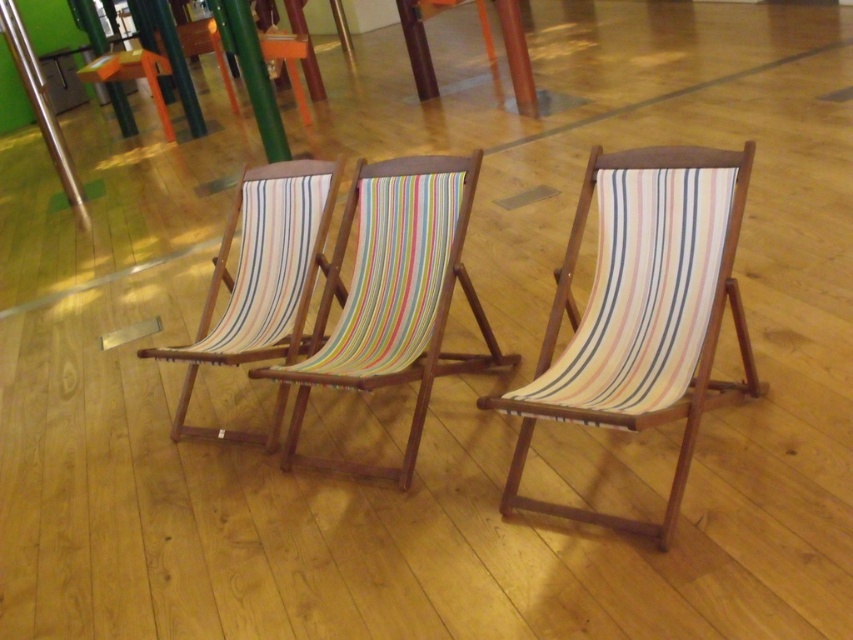
Is brushed metal pole at upper left wider than green wood pole at center?

Yes, brushed metal pole at upper left is wider than green wood pole at center.

Based on the photo, which is below, brushed metal pole at upper left or green wood pole at center?

Positioned lower is brushed metal pole at upper left.

Between point (77, 193) and point (273, 128), which one is positioned in front?

Point (273, 128) is in front.

The height and width of the screenshot is (640, 853). Find the location of `brushed metal pole at upper left`. brushed metal pole at upper left is located at coordinates (41, 106).

Does multicolored striped fabric deck chair at center lie in front of multicolored striped fabric at center?

Yes, multicolored striped fabric deck chair at center is closer to the viewer.

Can you confirm if multicolored striped fabric deck chair at center is taller than multicolored striped fabric at center?

In fact, multicolored striped fabric deck chair at center may be shorter than multicolored striped fabric at center.

Locate an element on the screen. multicolored striped fabric deck chair at center is located at coordinates (393, 292).

Locate an element on the screen. multicolored striped fabric deck chair at center is located at coordinates (393, 292).

Which is more to the right, striped fabric deck chair at center or brushed metal pole at upper left?

striped fabric deck chair at center is more to the right.

The height and width of the screenshot is (640, 853). What do you see at coordinates (641, 310) in the screenshot?
I see `striped fabric deck chair at center` at bounding box center [641, 310].

Identify the location of striped fabric deck chair at center. (641, 310).